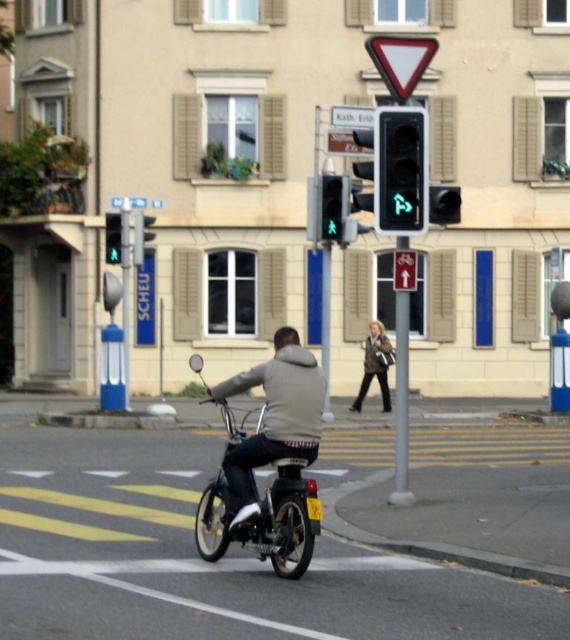
You are a pedestrian waiting at the crosswalk. You see the green glass traffic light at upper center and the dark brown leather jacket at center. Which object is positioned to the left of the other?

The green glass traffic light at upper center is to the left of the dark brown leather jacket at center.

You are a pedestrian waiting at the crosswalk. You see the green glass pedestrian signal at center and the white plastic sign at upper center. Which object is closer to you?

The green glass pedestrian signal at center is closer to you than the white plastic sign at upper center.